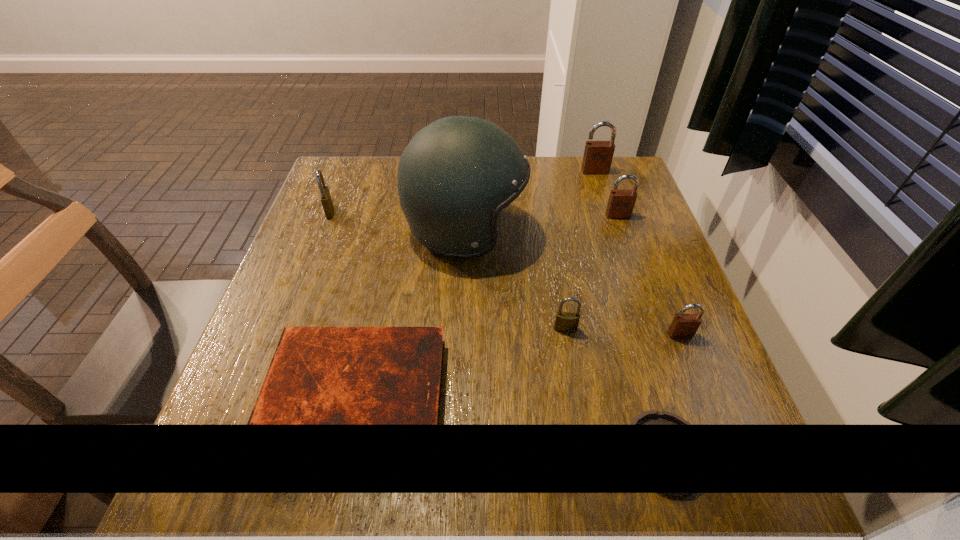
You are a GUI agent. You are given a task and a screenshot of the screen. Output one action in this format:
    pyautogui.click(x=<x>, y=<y>)
    Task: Click on the football helmet
    This screenshot has width=960, height=540.
    Given the screenshot: What is the action you would take?
    pyautogui.click(x=455, y=176)

At what (x,y) coordinates should I click in order to perform the action: click on the tallest object. Please return your answer as a coordinate pair (x, y). This screenshot has height=540, width=960. Looking at the image, I should click on (455, 176).

Find the location of a particular element. This screenshot has width=960, height=540. the farthest padlock is located at coordinates (598, 155).

Where is `the biggest brown padlock`? the biggest brown padlock is located at coordinates click(598, 155).

Identify the location of the farther brass padlock. (325, 197).

Locate an element on the screen. This screenshot has width=960, height=540. the leftmost object is located at coordinates (325, 197).

Image resolution: width=960 pixels, height=540 pixels. Find the location of `the second farthest brown padlock`. the second farthest brown padlock is located at coordinates (621, 203).

Identify the location of the right brass padlock. (565, 321).

Where is `the second padlock from left to right`? the second padlock from left to right is located at coordinates (565, 321).

Identify the location of the smallest brown padlock. This screenshot has height=540, width=960. (684, 326).